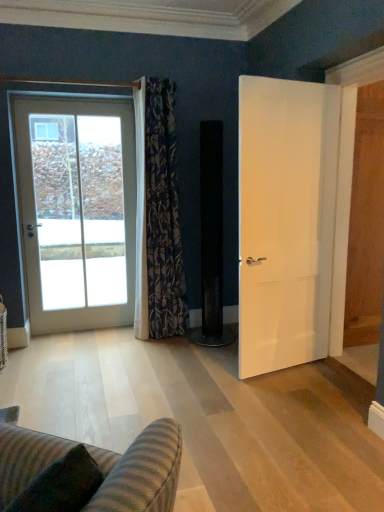
What do you see at coordinates (140, 471) in the screenshot?
I see `striped fabric couch at lower left` at bounding box center [140, 471].

The image size is (384, 512). Identify the location of floral-patterned fabric curtain at left. (158, 216).

This screenshot has height=512, width=384. What are the coordinates of `white matte door at right, the 2th door in the left-to-right sequence` in the screenshot? It's located at (285, 221).

From a real-world perspective, is striped fabric couch at lower left over white matte door at right, the 2th door in the left-to-right sequence?

Incorrect, from a real-world perspective, striped fabric couch at lower left is lower than white matte door at right, the 2th door in the left-to-right sequence.

Considering the relative sizes of striped fabric couch at lower left and white matte door at right, the 2th door in the left-to-right sequence, in the image provided, is striped fabric couch at lower left thinner than white matte door at right, the 2th door in the left-to-right sequence,?

No.

Which is more to the right, striped fabric couch at lower left or white matte door at right, the 2th door in the left-to-right sequence?

white matte door at right, the 2th door in the left-to-right sequence, is more to the right.

Does striped fabric couch at lower left have a larger size compared to white matte door at right, which is the 2th door from back to front?

No, striped fabric couch at lower left is not bigger than white matte door at right, which is the 2th door from back to front.

What's the angular difference between striped fabric couch at lower left and floral-patterned fabric curtain at left's facing directions?

128 degrees separate the facing orientations of striped fabric couch at lower left and floral-patterned fabric curtain at left.

Is point (2, 456) in front of point (175, 333)?

Yes, it is in front of point (175, 333).

From a real-world perspective, is striped fabric couch at lower left located beneath floral-patterned fabric curtain at left?

Yes, from a real-world perspective, striped fabric couch at lower left is beneath floral-patterned fabric curtain at left.

Measure the distance between striped fabric couch at lower left and floral-patterned fabric curtain at left.

The distance of striped fabric couch at lower left from floral-patterned fabric curtain at left is 2.50 meters.

Which object is thinner, white glass door at left, acting as the second door starting from the front, or floral-patterned fabric curtain at left?

Thinner between the two is white glass door at left, acting as the second door starting from the front.

From the image's perspective, is white glass door at left, which is counted as the 1th door, starting from the left, located above floral-patterned fabric curtain at left?

No, from the image's perspective, white glass door at left, which is counted as the 1th door, starting from the left, is not on top of floral-patterned fabric curtain at left.

I want to click on curtain in front of the white glass door at left, which is counted as the 1th door, starting from the left, so click(158, 216).

Considering the positions of objects white glass door at left, acting as the second door starting from the front, and floral-patterned fabric curtain at left in the image provided, who is more to the right, white glass door at left, acting as the second door starting from the front, or floral-patterned fabric curtain at left?

floral-patterned fabric curtain at left.

From the image's perspective, which is above, floral-patterned fabric curtain at left or white matte door at right, the 2th door in the left-to-right sequence?

floral-patterned fabric curtain at left appears higher in the image.

Which is in front, point (154, 323) or point (293, 288)?

The point (293, 288) is closer.

Does floral-patterned fabric curtain at left turn towards white matte door at right, the first door in the front-to-back sequence?

No, floral-patterned fabric curtain at left is not turned towards white matte door at right, the first door in the front-to-back sequence.

From the picture: Is white matte door at right, the 2th door in the left-to-right sequence, surrounded by floral-patterned fabric curtain at left?

No, white matte door at right, the 2th door in the left-to-right sequence, is not surrounded by floral-patterned fabric curtain at left.

Considering the positions of objects floral-patterned fabric curtain at left and striped fabric couch at lower left in the image provided, who is in front, floral-patterned fabric curtain at left or striped fabric couch at lower left?

striped fabric couch at lower left.

Can you confirm if floral-patterned fabric curtain at left is bigger than striped fabric couch at lower left?

Yes.

From the image's perspective, is floral-patterned fabric curtain at left located beneath striped fabric couch at lower left?

Actually, floral-patterned fabric curtain at left appears above striped fabric couch at lower left in the image.

Is floral-patterned fabric curtain at left oriented towards striped fabric couch at lower left?

No, floral-patterned fabric curtain at left is not facing towards striped fabric couch at lower left.

Looking at this image, which object is closer to the camera, white matte door at right, placed as the 1th door when sorted from right to left, or striped fabric couch at lower left?

striped fabric couch at lower left is more forward.

Consider the image. In terms of size, does white matte door at right, placed as the 1th door when sorted from right to left, appear bigger or smaller than striped fabric couch at lower left?

Clearly, white matte door at right, placed as the 1th door when sorted from right to left, is larger in size than striped fabric couch at lower left.

Looking at this image, is white matte door at right, the 2th door in the left-to-right sequence, placed right next to striped fabric couch at lower left?

No, white matte door at right, the 2th door in the left-to-right sequence, is not next to striped fabric couch at lower left.

Is white matte door at right, the 2th door in the left-to-right sequence, thinner than striped fabric couch at lower left?

Yes.

Which is in front, point (315, 192) or point (73, 100)?

Positioned in front is point (315, 192).

From the image's perspective, is white matte door at right, the first door in the front-to-back sequence, over white glass door at left, which ranks as the 1th door in back-to-front order?

No, from the image's perspective, white matte door at right, the first door in the front-to-back sequence, is not on top of white glass door at left, which ranks as the 1th door in back-to-front order.

Can you confirm if white matte door at right, placed as the 1th door when sorted from right to left, is thinner than white glass door at left, which is counted as the 1th door, starting from the left?

Correct, the width of white matte door at right, placed as the 1th door when sorted from right to left, is less than that of white glass door at left, which is counted as the 1th door, starting from the left.

Identify the location of studio couch below the white matte door at right, placed as the 1th door when sorted from right to left (from the image's perspective). (140, 471).

Identify the location of curtain above the striped fabric couch at lower left (from a real-world perspective). This screenshot has width=384, height=512. (158, 216).

Which object lies nearer to the anchor point striped fabric couch at lower left, white matte door at right, placed as the 1th door when sorted from right to left, or white glass door at left, which is counted as the 1th door, starting from the left?

Based on the image, white matte door at right, placed as the 1th door when sorted from right to left, appears to be nearer to striped fabric couch at lower left.

Considering their positions, is white glass door at left, which is counted as the 1th door, starting from the left, positioned closer to white matte door at right, the first door in the front-to-back sequence, than floral-patterned fabric curtain at left?

Based on the image, floral-patterned fabric curtain at left appears to be nearer to white matte door at right, the first door in the front-to-back sequence.

Based on their spatial positions, is striped fabric couch at lower left or white matte door at right, placed as the 1th door when sorted from right to left, further from white glass door at left, which ranks as the second door in right-to-left order?

striped fabric couch at lower left.

When comparing their distances from white matte door at right, the 2th door in the left-to-right sequence, does striped fabric couch at lower left or white glass door at left, acting as the second door starting from the front, seem closer?

white glass door at left, acting as the second door starting from the front, lies closer to white matte door at right, the 2th door in the left-to-right sequence, than the other object.

Estimate the real-world distances between objects in this image. Which object is further from floral-patterned fabric curtain at left, white glass door at left, acting as the second door starting from the front, or white matte door at right, which is the 2th door from back to front?

white matte door at right, which is the 2th door from back to front.

When comparing their distances from floral-patterned fabric curtain at left, does white matte door at right, the first door in the front-to-back sequence, or striped fabric couch at lower left seem closer?

white matte door at right, the first door in the front-to-back sequence, is closer to floral-patterned fabric curtain at left.

Which object lies further to the anchor point white glass door at left, which ranks as the second door in right-to-left order, floral-patterned fabric curtain at left or striped fabric couch at lower left?

The object further to white glass door at left, which ranks as the second door in right-to-left order, is striped fabric couch at lower left.

Considering their positions, is white matte door at right, which is the 2th door from back to front, positioned closer to striped fabric couch at lower left than floral-patterned fabric curtain at left?

Based on the image, white matte door at right, which is the 2th door from back to front, appears to be nearer to striped fabric couch at lower left.

Image resolution: width=384 pixels, height=512 pixels. In order to click on door located between striped fabric couch at lower left and white glass door at left, which ranks as the 1th door in back-to-front order, in the depth direction in this screenshot , I will do `click(285, 221)`.

You are a GUI agent. You are given a task and a screenshot of the screen. Output one action in this format:
    pyautogui.click(x=<x>, y=<y>)
    Task: Click on the curtain located between striped fabric couch at lower left and white glass door at left, which ranks as the 1th door in back-to-front order, in the depth direction
    The image size is (384, 512).
    Given the screenshot: What is the action you would take?
    pyautogui.click(x=158, y=216)

At what (x,y) coordinates should I click in order to perform the action: click on door between striped fabric couch at lower left and floral-patterned fabric curtain at left in the front-back direction. Please return your answer as a coordinate pair (x, y). Looking at the image, I should click on click(285, 221).

The height and width of the screenshot is (512, 384). I want to click on curtain between white glass door at left, acting as the second door starting from the front, and white matte door at right, the 2th door in the left-to-right sequence, from left to right, so click(158, 216).